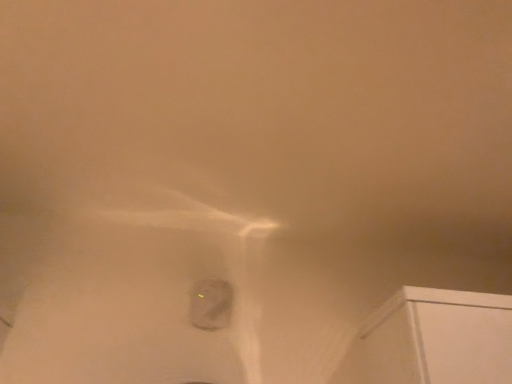
Question: Should I look upward or downward to see matte gray stone at center?

Choices:
 (A) down
 (B) up

Answer: (A)